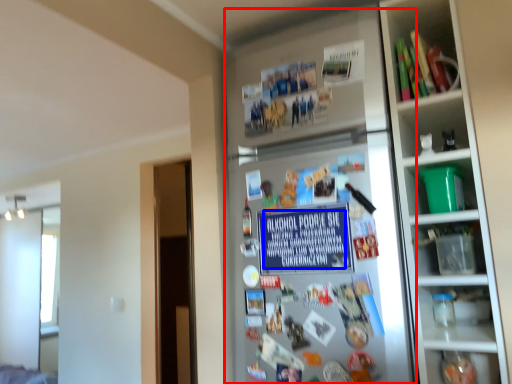
Question: Among these objects, which one is nearest to the camera, fridge (highlighted by a red box) or writing (highlighted by a blue box)?

Choices:
 (A) fridge
 (B) writing

Answer: (A)